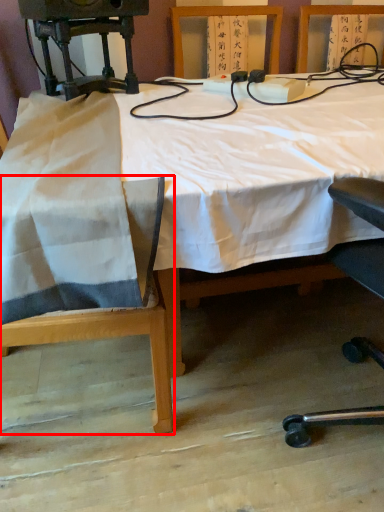
Question: From the image's perspective, where is chair (annotated by the red box) located in relation to table in the image?

Choices:
 (A) above
 (B) below

Answer: (B)